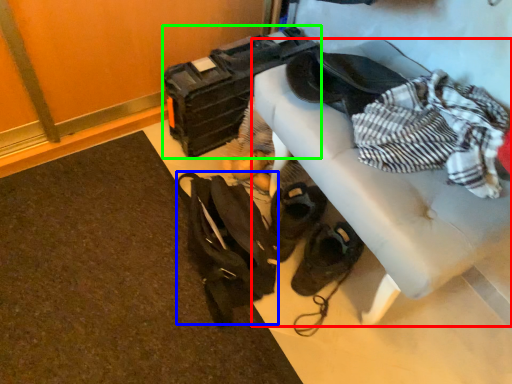
Question: Estimate the real-world distances between objects in this image. Which object is closer to furniture (highlighted by a red box), messenger bag (highlighted by a blue box) or luggage (highlighted by a green box)?

Choices:
 (A) messenger bag
 (B) luggage

Answer: (A)